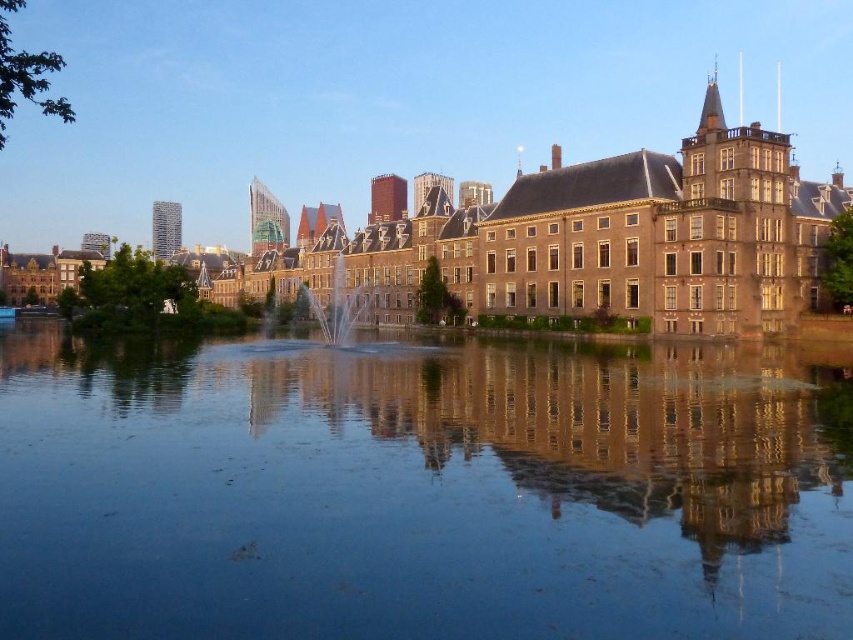
Question: Does smooth reflective water at center appear under clear glass fountain at center?

Choices:
 (A) no
 (B) yes

Answer: (B)

Question: Considering the real-world distances, which object is farthest from the brown stone building at center?

Choices:
 (A) clear glass fountain at center
 (B) smooth reflective water at center

Answer: (B)

Question: Is smooth reflective water at center to the left of clear glass fountain at center from the viewer's perspective?

Choices:
 (A) no
 (B) yes

Answer: (A)

Question: Which of the following is the closest to the observer?

Choices:
 (A) (363, 248)
 (B) (776, 481)

Answer: (B)

Question: Which object is farther from the camera taking this photo?

Choices:
 (A) brown stone building at center
 (B) clear glass fountain at center

Answer: (B)

Question: Is smooth reflective water at center bigger than clear glass fountain at center?

Choices:
 (A) no
 (B) yes

Answer: (B)